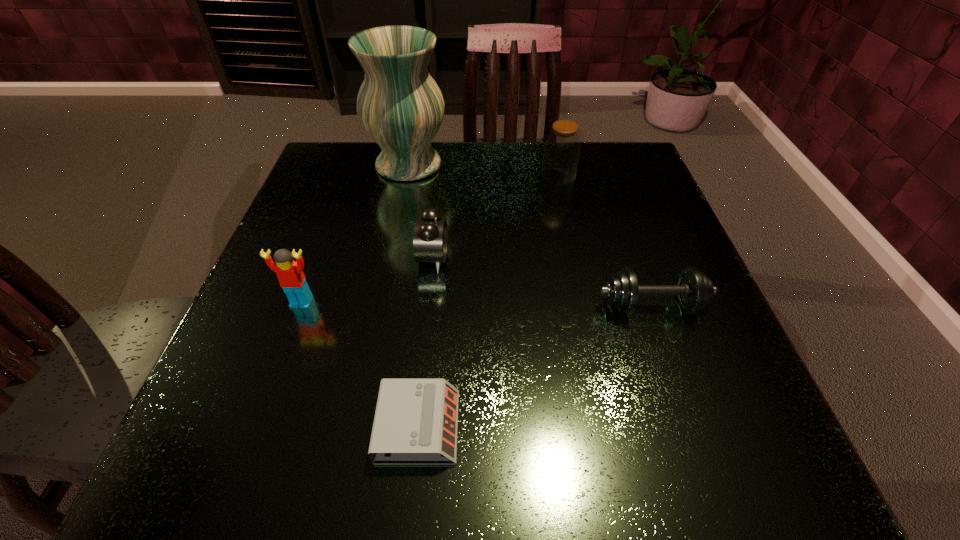
Identify the location of vacant region that satisfies the following two spatial constraints: 1. on the back side of the jar; 2. on the right side of the shorter alarm clock. The height and width of the screenshot is (540, 960). (444, 176).

This screenshot has width=960, height=540. I want to click on vacant space that satisfies the following two spatial constraints: 1. on the front side of the taller alarm clock; 2. on the face of the leftmost object, so pyautogui.click(x=428, y=302).

This screenshot has width=960, height=540. Identify the location of free space that satisfies the following two spatial constraints: 1. on the front side of the farther alarm clock; 2. on the left side of the dumbbell. (428, 306).

Identify the location of vacant point that satisfies the following two spatial constraints: 1. on the face of the dumbbell; 2. on the right side of the leftmost object. This screenshot has width=960, height=540. (300, 306).

Where is `free space that satisfies the following two spatial constraints: 1. on the face of the dumbbell; 2. on the left side of the Lego`? The width and height of the screenshot is (960, 540). free space that satisfies the following two spatial constraints: 1. on the face of the dumbbell; 2. on the left side of the Lego is located at coordinates (300, 306).

Identify the location of free space in the image that satisfies the following two spatial constraints: 1. on the front side of the third farthest object; 2. on the back side of the dumbbell. (428, 306).

Identify the location of vacant space that satisfies the following two spatial constraints: 1. on the back side of the nearest object; 2. on the left side of the dumbbell. The image size is (960, 540). (431, 306).